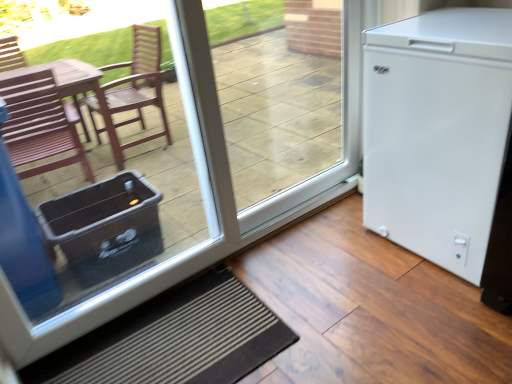
Question: Considering the relative positions of white matte refrigerator at right and black textured mat at lower center in the image provided, is white matte refrigerator at right to the right of black textured mat at lower center from the viewer's perspective?

Choices:
 (A) no
 (B) yes

Answer: (B)

Question: Is black textured mat at lower center a part of white matte refrigerator at right?

Choices:
 (A) yes
 (B) no

Answer: (B)

Question: Does white matte refrigerator at right have a greater width compared to black textured mat at lower center?

Choices:
 (A) no
 (B) yes

Answer: (A)

Question: Considering the relative sizes of white matte refrigerator at right and black textured mat at lower center in the image provided, is white matte refrigerator at right shorter than black textured mat at lower center?

Choices:
 (A) no
 (B) yes

Answer: (A)

Question: Is white matte refrigerator at right not inside black textured mat at lower center?

Choices:
 (A) no
 (B) yes

Answer: (B)

Question: From the image's perspective, relative to black textured mat at lower center, is white matte refrigerator at right above or below?

Choices:
 (A) below
 (B) above

Answer: (B)

Question: Considering the relative positions of white matte refrigerator at right and black textured mat at lower center in the image provided, is white matte refrigerator at right to the left or to the right of black textured mat at lower center?

Choices:
 (A) right
 (B) left

Answer: (A)

Question: Considering the positions of white matte refrigerator at right and black textured mat at lower center in the image, is white matte refrigerator at right taller or shorter than black textured mat at lower center?

Choices:
 (A) tall
 (B) short

Answer: (A)

Question: Does point (322, 190) appear closer or farther from the camera than point (66, 375)?

Choices:
 (A) closer
 (B) farther

Answer: (B)

Question: Is white matte refrigerator at right wider or thinner than white matte refrigerator at right?

Choices:
 (A) thin
 (B) wide

Answer: (B)

Question: Is white matte refrigerator at right spatially inside white matte refrigerator at right, or outside of it?

Choices:
 (A) inside
 (B) outside

Answer: (B)

Question: From a real-world perspective, is white matte refrigerator at right positioned above or below white matte refrigerator at right?

Choices:
 (A) above
 (B) below

Answer: (B)

Question: From their relative heights in the image, would you say white matte refrigerator at right is taller or shorter than white matte refrigerator at right?

Choices:
 (A) tall
 (B) short

Answer: (B)

Question: Looking at the image, does transparent glass door at center seem bigger or smaller compared to white matte refrigerator at right?

Choices:
 (A) big
 (B) small

Answer: (B)

Question: From the image's perspective, relative to white matte refrigerator at right, is transparent glass door at center above or below?

Choices:
 (A) above
 (B) below

Answer: (A)